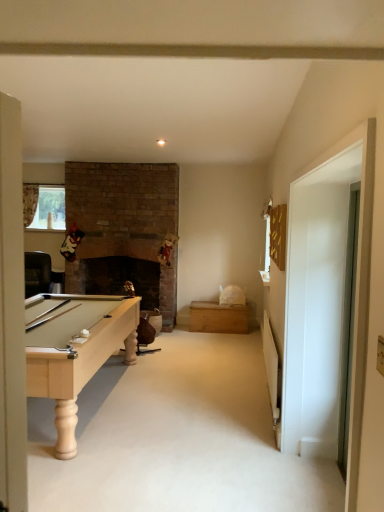
Find the location of a particular element. clear glass window at upper left is located at coordinates (49, 209).

Is wooden chest at center positioned with its back to white glossy door at right, placed as the first glass door when sorted from left to right?

No, white glossy door at right, placed as the first glass door when sorted from left to right, is not at the back of wooden chest at center.

Is wooden chest at center wider than white glossy door at right, the 2th glass door positioned from the right?

Yes.

Is point (194, 321) behind point (328, 426)?

Yes, it is.

From the image's perspective, which one is positioned lower, clear glass window at upper left or wooden chest at center?

wooden chest at center is shown below in the image.

Is clear glass window at upper left taller or shorter than wooden chest at center?

Considering their sizes, clear glass window at upper left has more height than wooden chest at center.

Image resolution: width=384 pixels, height=512 pixels. What are the coordinates of `drawer that appears below the clear glass window at upper left (from the image's perspective)` in the screenshot? It's located at (218, 317).

Is wooden chest at center positioned far away from clear glass window at upper left?

That's right, there is a large distance between wooden chest at center and clear glass window at upper left.

What's the angular difference between wooden chest at center and clear glass window at upper left's facing directions?

wooden chest at center and clear glass window at upper left are facing 2.4 degrees away from each other.

Is wooden chest at center located outside clear glass window at upper left?

Yes.

Considering the sizes of objects wooden chest at center and clear glass window at upper left in the image provided, who is bigger, wooden chest at center or clear glass window at upper left?

With larger size is wooden chest at center.

Is white glossy door at right, placed as the first glass door when sorted from left to right, with wooden chest at center?

There is a gap between white glossy door at right, placed as the first glass door when sorted from left to right, and wooden chest at center.

Considering the sizes of objects white glossy door at right, placed as the first glass door when sorted from left to right, and wooden chest at center in the image provided, who is thinner, white glossy door at right, placed as the first glass door when sorted from left to right, or wooden chest at center?

Thinner between the two is white glossy door at right, placed as the first glass door when sorted from left to right.

Is white glossy door at right, the 2th glass door positioned from the right, in front of or behind wooden chest at center in the image?

Clearly, white glossy door at right, the 2th glass door positioned from the right, is in front of wooden chest at center.

Is transparent glass door at right, which appears as the 1th glass door when viewed from the right, turned away from white glossy door at right, placed as the first glass door when sorted from left to right?

No.

Looking at this image, is transparent glass door at right, which appears as the 1th glass door when viewed from the right, positioned behind white glossy door at right, placed as the first glass door when sorted from left to right?

Yes, the depth of transparent glass door at right, which appears as the 1th glass door when viewed from the right, is greater than that of white glossy door at right, placed as the first glass door when sorted from left to right.

Identify the location of glass door on the left side of transparent glass door at right, which appears as the 1th glass door when viewed from the right. The image size is (384, 512). (316, 306).

Which point is more distant from viewer, (346, 424) or (302, 454)?

Point (302, 454)

From a real-world perspective, is transparent glass door at right, the 2th glass door viewed from the left, beneath clear glass window at upper left?

Correct, in the physical world, transparent glass door at right, the 2th glass door viewed from the left, is lower than clear glass window at upper left.

From the image's perspective, which is below, transparent glass door at right, which appears as the 1th glass door when viewed from the right, or clear glass window at upper left?

transparent glass door at right, which appears as the 1th glass door when viewed from the right, appears lower in the image.

Can you confirm if transparent glass door at right, which appears as the 1th glass door when viewed from the right, is taller than clear glass window at upper left?

Yes, transparent glass door at right, which appears as the 1th glass door when viewed from the right, is taller than clear glass window at upper left.

From the image's perspective, starting from the clear glass window at upper left, which glass door is the 1st one below? Please provide its 2D coordinates.

[(348, 327)]

Which is farther, (224, 307) or (337, 463)?

The point (224, 307) is farther.

Which is more to the right, wooden chest at center or transparent glass door at right, the 2th glass door viewed from the left?

transparent glass door at right, the 2th glass door viewed from the left, is more to the right.

How different are the orientations of wooden chest at center and transparent glass door at right, the 2th glass door viewed from the left, in degrees?

Result: There is a 92.6-degree angle between the facing directions of wooden chest at center and transparent glass door at right, the 2th glass door viewed from the left.

In terms of width, does wooden chest at center look wider or thinner when compared to transparent glass door at right, the 2th glass door viewed from the left?

wooden chest at center is wider than transparent glass door at right, the 2th glass door viewed from the left.

Find the location of a particular element. Image resolution: width=384 pixels, height=512 pixels. drawer on the left side of white glossy door at right, the 2th glass door positioned from the right is located at coordinates (218, 317).

Locate an element on the screen. Image resolution: width=384 pixels, height=512 pixels. drawer that appears on the right of clear glass window at upper left is located at coordinates (218, 317).

Estimate the real-world distances between objects in this image. Which object is further from clear glass window at upper left, white glossy door at right, the 2th glass door positioned from the right, or transparent glass door at right, which appears as the 1th glass door when viewed from the right?

The object further to clear glass window at upper left is transparent glass door at right, which appears as the 1th glass door when viewed from the right.

Based on their spatial positions, is transparent glass door at right, which appears as the 1th glass door when viewed from the right, or clear glass window at upper left closer to wooden chest at center?

Among the two, clear glass window at upper left is located nearer to wooden chest at center.

When comparing their distances from clear glass window at upper left, does wooden chest at center or white glossy door at right, placed as the first glass door when sorted from left to right, seem further?

white glossy door at right, placed as the first glass door when sorted from left to right.

When comparing their distances from white glossy door at right, the 2th glass door positioned from the right, does transparent glass door at right, the 2th glass door viewed from the left, or clear glass window at upper left seem closer?

Based on the image, transparent glass door at right, the 2th glass door viewed from the left, appears to be nearer to white glossy door at right, the 2th glass door positioned from the right.

From the image, which object appears to be nearer to transparent glass door at right, which appears as the 1th glass door when viewed from the right, clear glass window at upper left or white glossy door at right, the 2th glass door positioned from the right?

white glossy door at right, the 2th glass door positioned from the right, lies closer to transparent glass door at right, which appears as the 1th glass door when viewed from the right, than the other object.

Based on their spatial positions, is wooden chest at center or clear glass window at upper left closer to white glossy door at right, placed as the first glass door when sorted from left to right?

wooden chest at center lies closer to white glossy door at right, placed as the first glass door when sorted from left to right, than the other object.

Considering their positions, is wooden chest at center positioned closer to white glossy door at right, the 2th glass door positioned from the right, than transparent glass door at right, the 2th glass door viewed from the left?

The object closer to white glossy door at right, the 2th glass door positioned from the right, is transparent glass door at right, the 2th glass door viewed from the left.

Estimate the real-world distances between objects in this image. Which object is further from white glossy door at right, placed as the first glass door when sorted from left to right, clear glass window at upper left or wooden chest at center?

clear glass window at upper left is positioned further to the anchor white glossy door at right, placed as the first glass door when sorted from left to right.

Find the location of a particular element. The width and height of the screenshot is (384, 512). drawer between white glossy door at right, the 2th glass door positioned from the right, and clear glass window at upper left, along the z-axis is located at coordinates tap(218, 317).

The image size is (384, 512). I want to click on drawer located between transparent glass door at right, which appears as the 1th glass door when viewed from the right, and clear glass window at upper left in the depth direction, so click(x=218, y=317).

Locate an element on the screen. glass door located between white glossy door at right, placed as the first glass door when sorted from left to right, and clear glass window at upper left in the depth direction is located at coordinates (348, 327).

Image resolution: width=384 pixels, height=512 pixels. What are the coordinates of `glass door positioned between white glossy door at right, the 2th glass door positioned from the right, and wooden chest at center from near to far` in the screenshot? It's located at (348, 327).